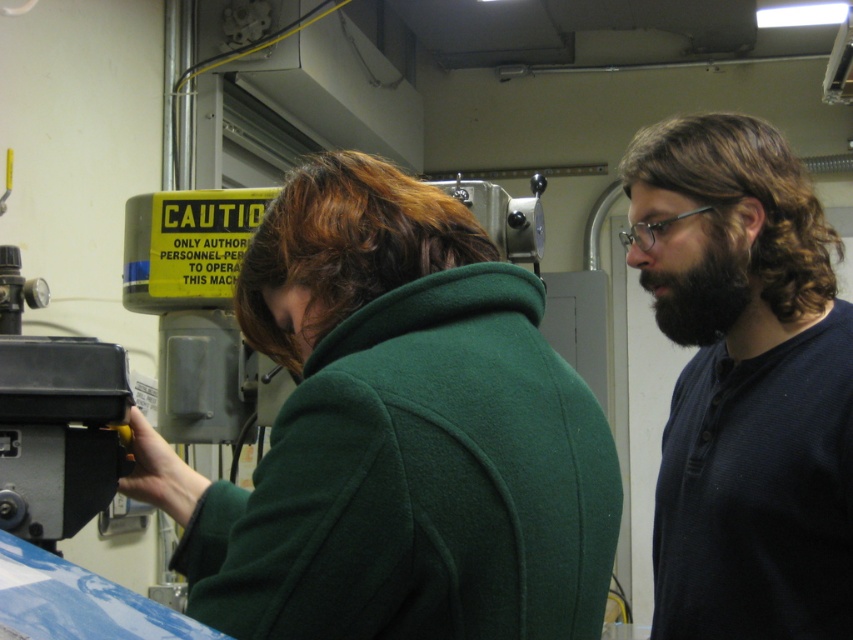
Looking at this image, who is higher up, green woolen coat at center or black fuzzy beard at right?

black fuzzy beard at right

Which is behind, point (260, 468) or point (692, 340)?

Point (692, 340)

Image resolution: width=853 pixels, height=640 pixels. Describe the element at coordinates (397, 435) in the screenshot. I see `green woolen coat at center` at that location.

Locate an element on the screen. The image size is (853, 640). green woolen coat at center is located at coordinates (397, 435).

Is dark blue knit sweater at right above black fuzzy beard at right?

Actually, dark blue knit sweater at right is below black fuzzy beard at right.

Does dark blue knit sweater at right have a smaller size compared to black fuzzy beard at right?

Actually, dark blue knit sweater at right might be larger than black fuzzy beard at right.

Find the location of a particular element. This screenshot has height=640, width=853. dark blue knit sweater at right is located at coordinates (746, 384).

At what (x,y) coordinates should I click in order to perform the action: click on dark blue knit sweater at right. Please return your answer as a coordinate pair (x, y). The image size is (853, 640). Looking at the image, I should click on (746, 384).

Which is behind, point (399, 422) or point (821, 474)?

Point (821, 474)

Between green woolen coat at center and dark blue knit sweater at right, which one is positioned higher?

Positioned higher is dark blue knit sweater at right.

Between point (357, 236) and point (793, 400), which one is positioned behind?

The point (793, 400) is more distant.

Identify the location of green woolen coat at center. (397, 435).